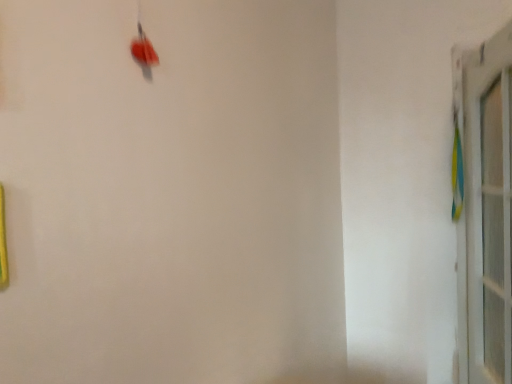
Measure the distance between point (473, 173) and camera.

Point (473, 173) and camera are 1.78 meters apart from each other.

Locate an element on the screen. The height and width of the screenshot is (384, 512). white glossy door at right is located at coordinates (484, 207).

The height and width of the screenshot is (384, 512). Describe the element at coordinates (484, 207) in the screenshot. I see `white glossy door at right` at that location.

The image size is (512, 384). I want to click on white glossy door at right, so click(x=484, y=207).